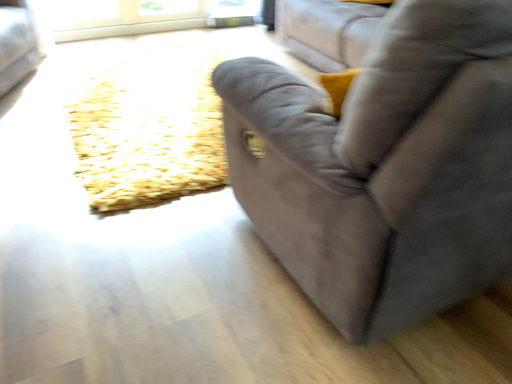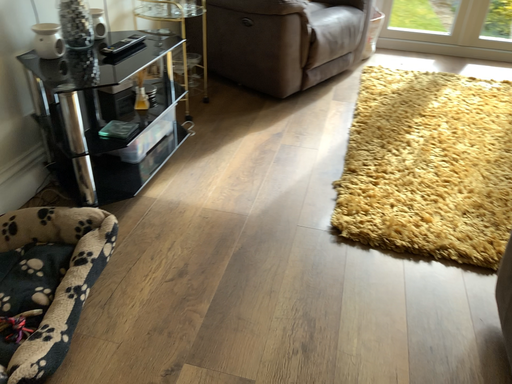
Question: Which way did the camera rotate in the video?

Choices:
 (A) rotated downward
 (B) rotated upward

Answer: (B)